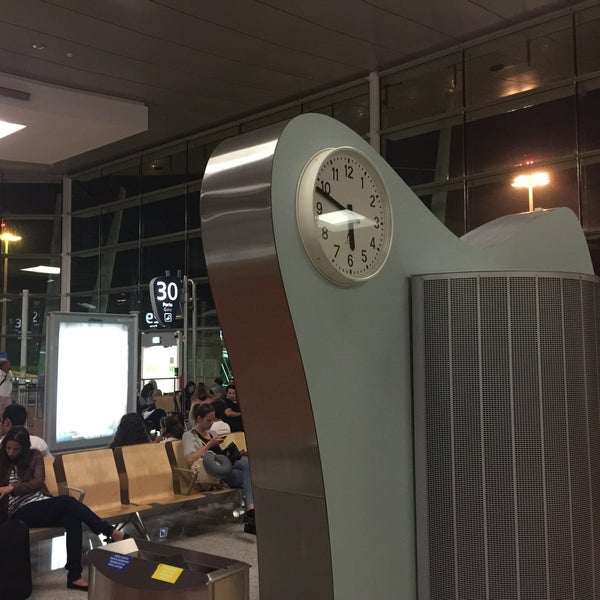
Find the location of a particular element. This screenshot has width=600, height=600. clock is located at coordinates (361, 203).